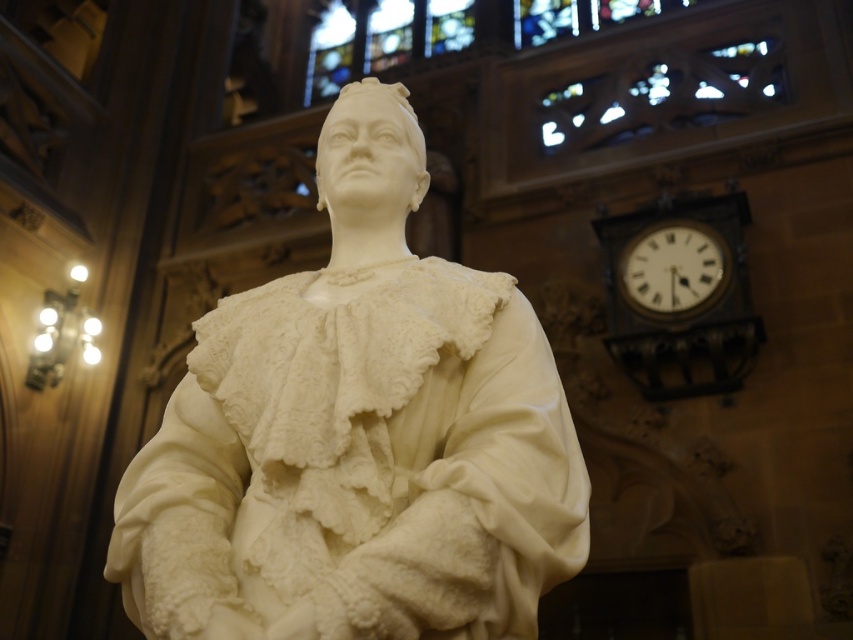
Question: Which of the following is the closest to the observer?

Choices:
 (A) (647, 234)
 (B) (714, 392)
 (C) (384, 177)

Answer: (C)

Question: Can you confirm if dark brown wooden clock at upper right is positioned below white wooden clock at upper right?

Choices:
 (A) no
 (B) yes

Answer: (B)

Question: Which object is positioned farthest from the dark brown wooden clock at upper right?

Choices:
 (A) white wooden clock at upper right
 (B) white marble statue at center

Answer: (B)

Question: Among these points, which one is farthest from the camera?

Choices:
 (A) (564, 476)
 (B) (653, 275)
 (C) (712, 292)

Answer: (B)

Question: In this image, where is white marble statue at center located relative to dark brown wooden clock at upper right?

Choices:
 (A) above
 (B) below

Answer: (B)

Question: Is white marble statue at center closer to the viewer compared to white wooden clock at upper right?

Choices:
 (A) yes
 (B) no

Answer: (A)